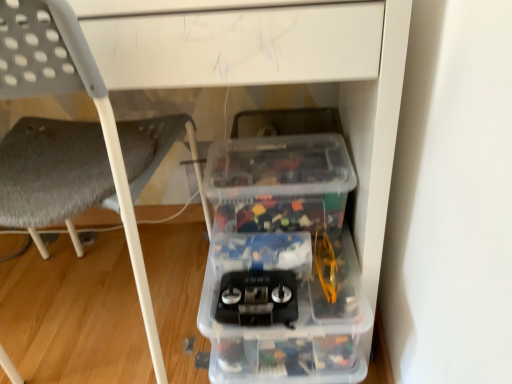
Question: Is gray fabric chair at lower left taller than transparent plastic storage box at lower right?

Choices:
 (A) yes
 (B) no

Answer: (A)

Question: Does gray fabric chair at lower left have a larger size compared to transparent plastic storage box at lower right?

Choices:
 (A) yes
 (B) no

Answer: (A)

Question: Could you tell me if gray fabric chair at lower left is turned towards transparent plastic storage box at lower right?

Choices:
 (A) yes
 (B) no

Answer: (B)

Question: Is gray fabric chair at lower left positioned in front of transparent plastic storage box at lower right?

Choices:
 (A) yes
 (B) no

Answer: (A)

Question: Can transparent plastic storage box at lower right be found inside gray fabric chair at lower left?

Choices:
 (A) yes
 (B) no

Answer: (B)

Question: Is gray fabric chair at lower left outside transparent plastic storage box at lower right?

Choices:
 (A) yes
 (B) no

Answer: (A)

Question: Does transparent plastic storage box at lower right have a smaller size compared to gray fabric chair at lower left?

Choices:
 (A) yes
 (B) no

Answer: (A)

Question: Is transparent plastic storage box at lower right far away from gray fabric chair at lower left?

Choices:
 (A) no
 (B) yes

Answer: (A)

Question: Is gray fabric chair at lower left at the back of transparent plastic storage box at lower right?

Choices:
 (A) no
 (B) yes

Answer: (A)

Question: From a real-world perspective, is transparent plastic storage box at lower right physically above gray fabric chair at lower left?

Choices:
 (A) no
 (B) yes

Answer: (A)

Question: Can you confirm if transparent plastic storage box at lower right is taller than gray fabric chair at lower left?

Choices:
 (A) no
 (B) yes

Answer: (A)

Question: Is transparent plastic storage box at lower right next to gray fabric chair at lower left and touching it?

Choices:
 (A) yes
 (B) no

Answer: (B)

Question: Considering the positions of gray fabric chair at lower left and transparent plastic storage box at lower right in the image, is gray fabric chair at lower left taller or shorter than transparent plastic storage box at lower right?

Choices:
 (A) short
 (B) tall

Answer: (B)